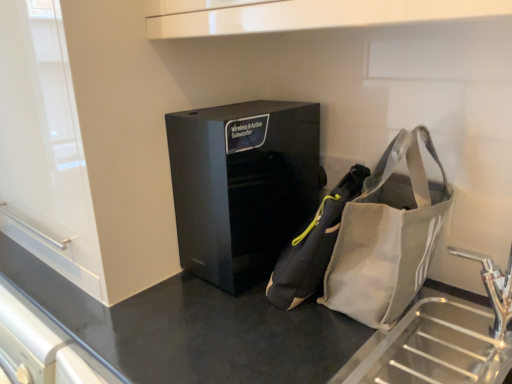
Locate an element on the screen. free space above black glossy speaker at center (from a real-world perspective) is located at coordinates (245, 108).